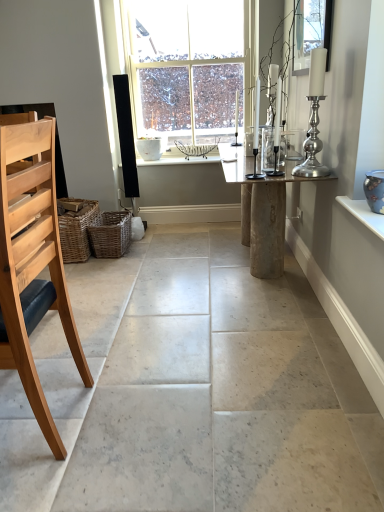
The width and height of the screenshot is (384, 512). I want to click on free point below rustic wood table at center (from a real-world perspective), so click(249, 278).